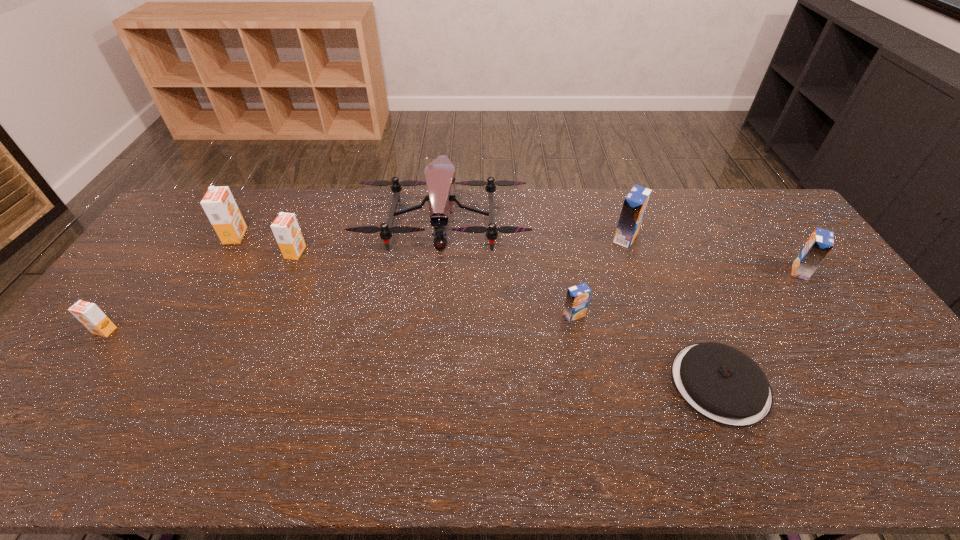
Where is `vacant space at the left edge of the desktop`? vacant space at the left edge of the desktop is located at coordinates (197, 241).

In the image, there is a desktop. Where is `blank space at the far left corner`? This screenshot has height=540, width=960. blank space at the far left corner is located at coordinates (174, 228).

Identify the location of free spot between the pancake and the second biggest orange orange juice. This screenshot has height=540, width=960. (508, 318).

This screenshot has width=960, height=540. What are the coordinates of `unoccupied area between the nearest blue orange_juice and the rightmost object` in the screenshot? It's located at (687, 293).

At what (x,y) coordinates should I click in order to perform the action: click on vacant area that lies between the fifth orange juice from right to left and the gray drone. Please return your answer as a coordinate pair (x, y). Image resolution: width=960 pixels, height=540 pixels. Looking at the image, I should click on (339, 229).

Find the location of a particular element. empty location between the second biggest orange orange juice and the second biggest blue orange_juice is located at coordinates (548, 262).

Where is `free space between the third nearest object and the third orange juice from left to right`? The image size is (960, 540). free space between the third nearest object and the third orange juice from left to right is located at coordinates (435, 284).

Where is `empty location between the farthest orange orange juice and the nearest object`? The height and width of the screenshot is (540, 960). empty location between the farthest orange orange juice and the nearest object is located at coordinates (477, 309).

What are the coordinates of `vacant point located between the biggest blue orange_juice and the biggest orange orange juice` in the screenshot? It's located at (430, 237).

Locate an element on the screen. free point between the second biggest blue orange_juice and the rightmost orange orange juice is located at coordinates (548, 262).